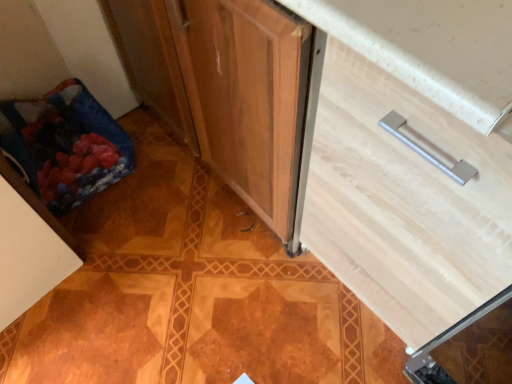
Question: Is blue fabric bag at lower left oriented away from white matte cabinet at lower left?

Choices:
 (A) no
 (B) yes

Answer: (A)

Question: Does blue fabric bag at lower left have a lesser height compared to white matte cabinet at lower left?

Choices:
 (A) no
 (B) yes

Answer: (B)

Question: Can you confirm if blue fabric bag at lower left is bigger than white matte cabinet at lower left?

Choices:
 (A) no
 (B) yes

Answer: (A)

Question: Can we say blue fabric bag at lower left lies outside white matte cabinet at lower left?

Choices:
 (A) yes
 (B) no

Answer: (A)

Question: Does blue fabric bag at lower left appear on the right side of white matte cabinet at lower left?

Choices:
 (A) no
 (B) yes

Answer: (B)

Question: From the image's perspective, is blue fabric bag at lower left on top of white matte cabinet at lower left?

Choices:
 (A) yes
 (B) no

Answer: (A)

Question: Is blue fabric bag at lower left to the right of light wood drawer at center from the viewer's perspective?

Choices:
 (A) no
 (B) yes

Answer: (A)

Question: Does blue fabric bag at lower left come in front of light wood drawer at center?

Choices:
 (A) yes
 (B) no

Answer: (B)

Question: Considering the relative sizes of blue fabric bag at lower left and light wood drawer at center in the image provided, is blue fabric bag at lower left bigger than light wood drawer at center?

Choices:
 (A) no
 (B) yes

Answer: (A)

Question: Is light wood drawer at center at the back of blue fabric bag at lower left?

Choices:
 (A) no
 (B) yes

Answer: (A)

Question: Is blue fabric bag at lower left wider than light wood drawer at center?

Choices:
 (A) no
 (B) yes

Answer: (A)

Question: Can you confirm if blue fabric bag at lower left is smaller than light wood drawer at center?

Choices:
 (A) no
 (B) yes

Answer: (B)

Question: From the image's perspective, would you say light wood drawer at center is positioned over white matte cabinet at lower left?

Choices:
 (A) yes
 (B) no

Answer: (A)